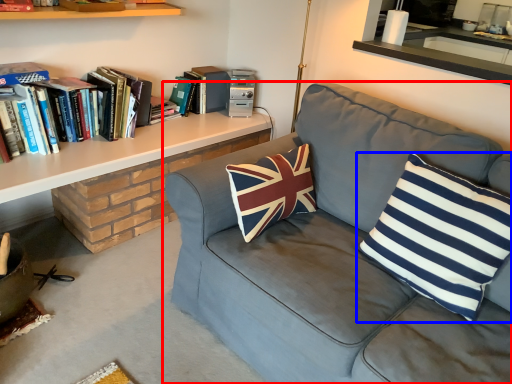
Question: Which object appears farthest to the camera in this image, studio couch (highlighted by a red box) or pillow (highlighted by a blue box)?

Choices:
 (A) studio couch
 (B) pillow

Answer: (B)